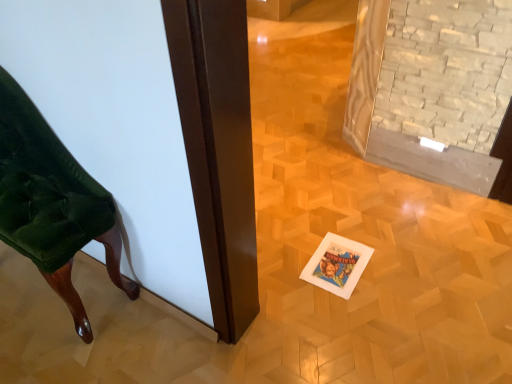
Where is `vacant space underneath white paper postcard at center (from a real-world perspective)`? The height and width of the screenshot is (384, 512). vacant space underneath white paper postcard at center (from a real-world perspective) is located at coordinates (331, 264).